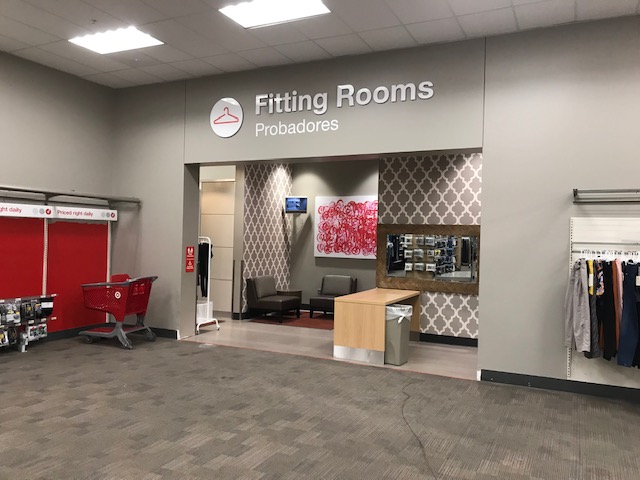
At what (x,y) coordinates should I click in order to perform the action: click on tv. Please return your answer as a coordinate pair (x, y). The height and width of the screenshot is (480, 640). Looking at the image, I should click on (291, 208).